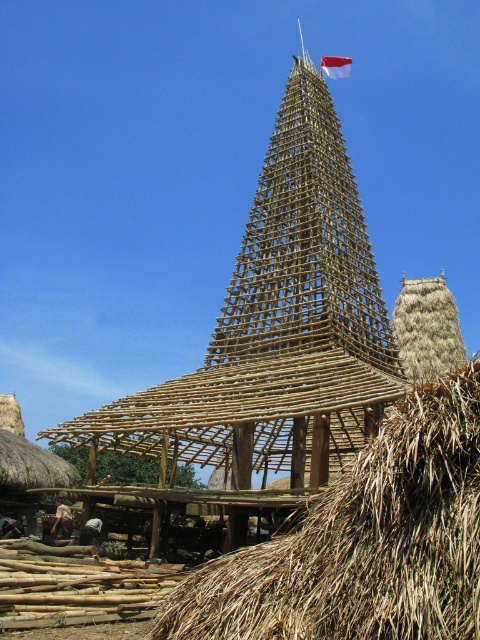
Question: Can you confirm if brown thatch at center is smaller than red fabric flag at upper center?

Choices:
 (A) yes
 (B) no

Answer: (B)

Question: Which point is farther from the camera taking this photo?

Choices:
 (A) (410, 524)
 (B) (335, 64)

Answer: (B)

Question: Which of the following is the closest to the observer?

Choices:
 (A) (422, 472)
 (B) (338, 64)

Answer: (A)

Question: Does brown thatch at center have a smaller size compared to red fabric flag at upper center?

Choices:
 (A) yes
 (B) no

Answer: (B)

Question: Is brown thatch at center positioned behind red fabric flag at upper center?

Choices:
 (A) yes
 (B) no

Answer: (B)